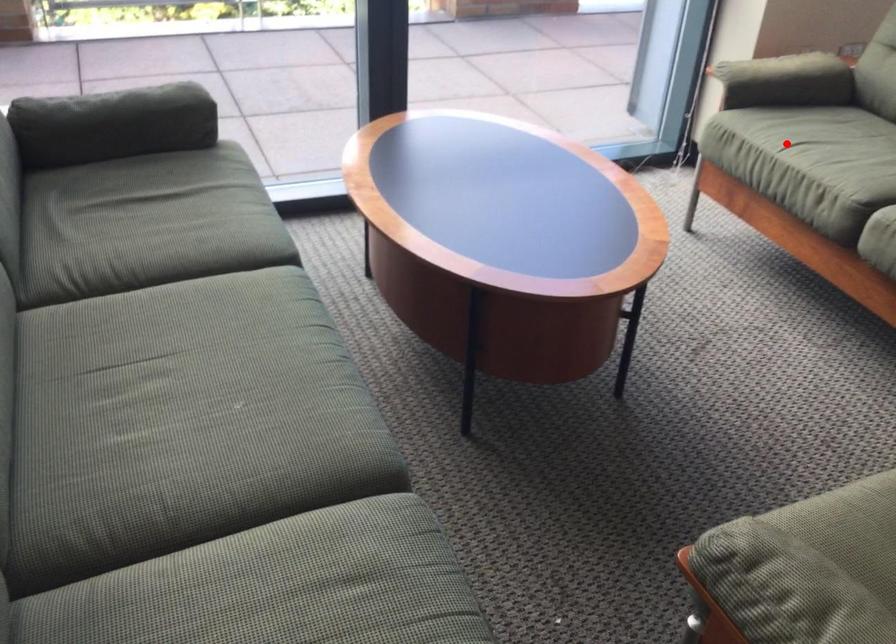
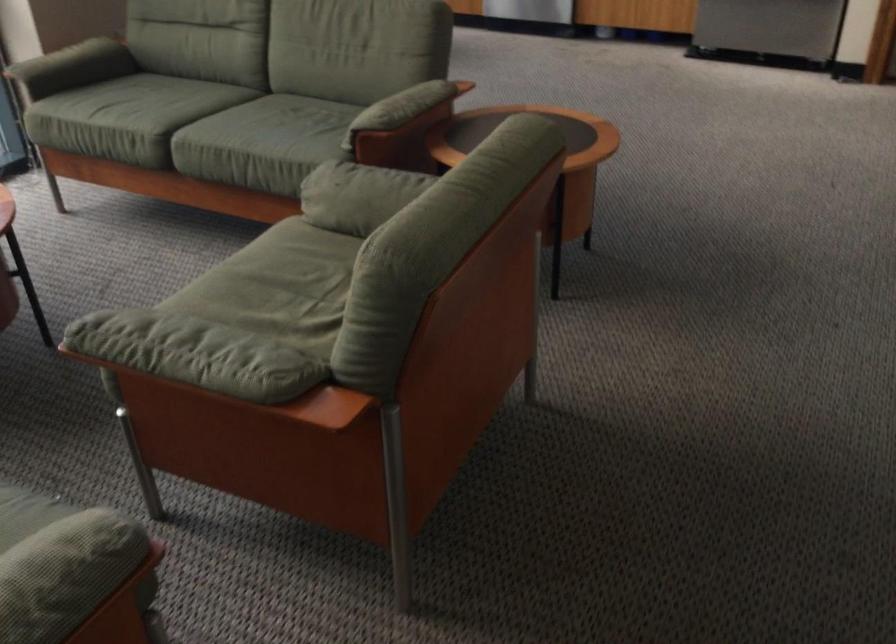
Question: I am providing you with two images of the same scene from different viewpoints. A red point is shown in image1. For the corresponding object point in image2, is it positioned nearer or farther from the camera?

Choices:
 (A) Nearer
 (B) Farther

Answer: (B)